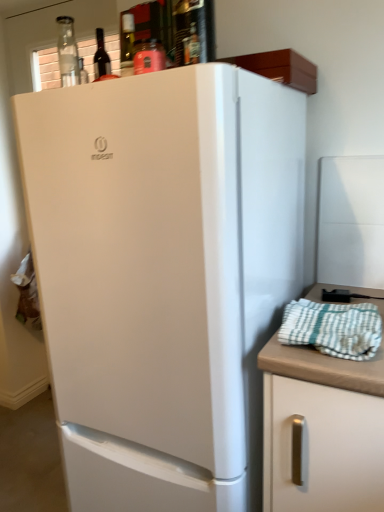
Question: Based on their positions, is white matte refrigerator at center located to the left or right of white matte cabinet at right?

Choices:
 (A) left
 (B) right

Answer: (A)

Question: From the image's perspective, is white matte refrigerator at center located above or below white matte cabinet at right?

Choices:
 (A) above
 (B) below

Answer: (A)

Question: Estimate the real-world distances between objects in this image. Which object is farther from the matte glass wine bottle at upper center?

Choices:
 (A) white matte cabinet at right
 (B) white checkered towel at right
 (C) white matte refrigerator at center

Answer: (A)

Question: Which of these objects is positioned closest to the white matte refrigerator at center?

Choices:
 (A) matte glass wine bottle at upper center
 (B) white matte cabinet at right
 (C) white checkered towel at right

Answer: (B)